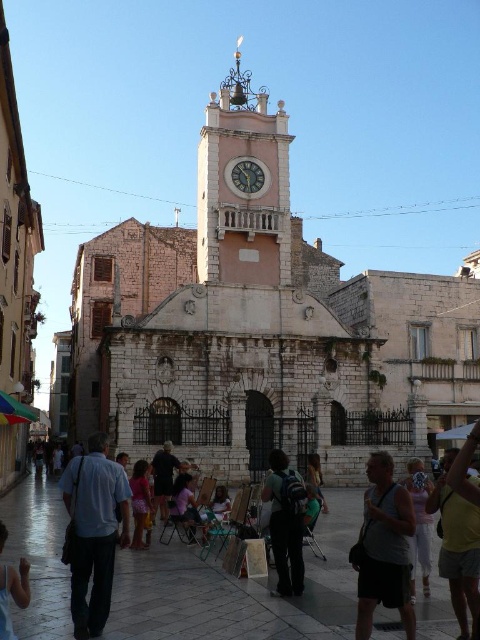
You are an artist in the courtyard and want to display your two artworks, the gray fabric tank top at center and the pink fabric dress at lower center. Since you want to emphasize the larger artwork, which one should you place in a more prominent position?

The gray fabric tank top at center is larger in size than the pink fabric dress at lower center, so you should place the gray fabric tank top at center in a more prominent position to emphasize its size.

You are an event organizer setting up a photo shoot in the courtyard. You need to place a backdrop that must be wider than both the gray fabric tank top at center and the pink fabric dress at lower center. What is the minimum width your backdrop should have?

The gray fabric tank top at center is wider than the pink fabric dress at lower center. To ensure the backdrop is wider than both, the minimum width should be greater than the gray fabric tank top at center.